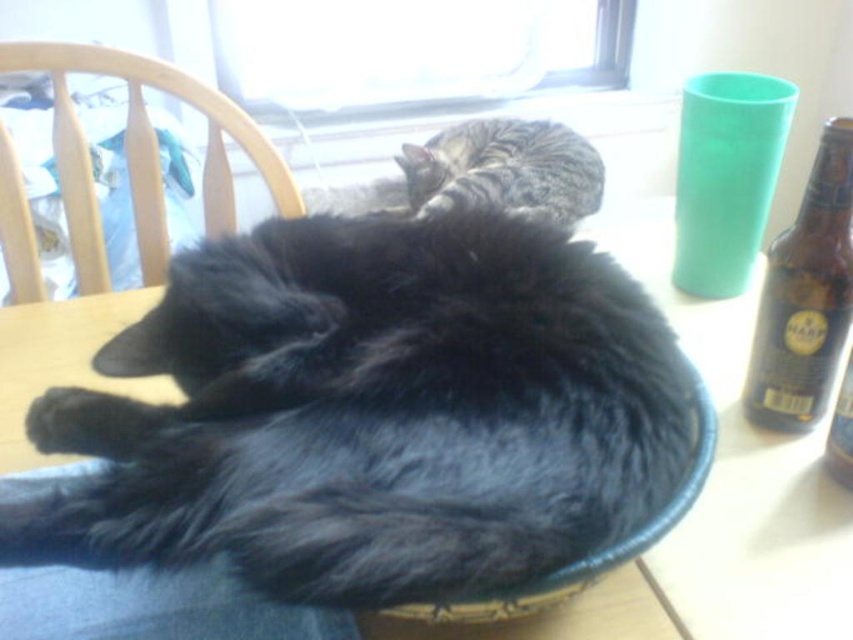
Question: Which point is closer to the camera taking this photo?

Choices:
 (A) (236, 124)
 (B) (419, 193)
 (C) (827, 168)
 (D) (548, 589)

Answer: (D)

Question: Can you confirm if brown glass bottle at right is smaller than tabby fur cat at upper center?

Choices:
 (A) no
 (B) yes

Answer: (B)

Question: Which point is farther from the camera taking this photo?

Choices:
 (A) (196, 451)
 (B) (807, 276)

Answer: (B)

Question: Is black fluffy cat at center wider than brown glass bottle at right?

Choices:
 (A) no
 (B) yes

Answer: (B)

Question: Which point is farther from the camera taking this photo?

Choices:
 (A) (712, 435)
 (B) (471, 189)
 (C) (781, 400)

Answer: (B)

Question: Does black fluffy cat at center appear on the left side of tabby fur cat at upper center?

Choices:
 (A) no
 (B) yes

Answer: (B)